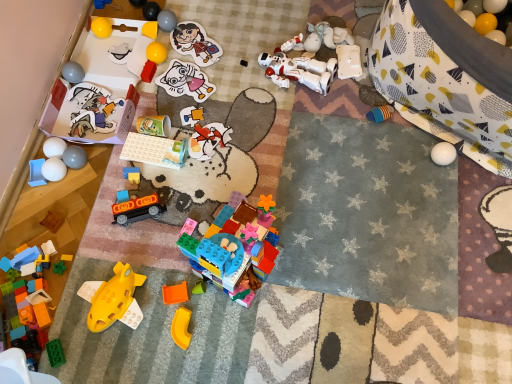
Identify the location of vacant area that lies between white matte robot at upper center, the 3th toy viewed from the right, and translucent orange plastic toy at center, placed as the 22th toy when sorted from left to right. (263, 143).